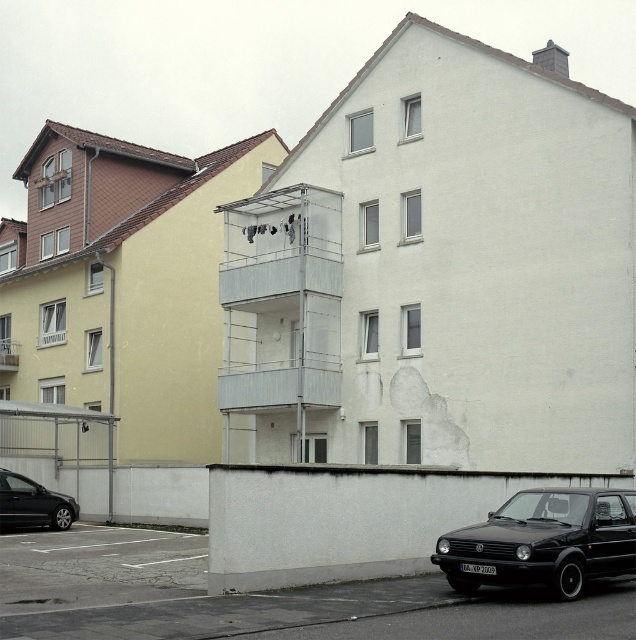
Question: Which point is closer to the camera?

Choices:
 (A) black matte car at lower left
 (B) black matte hatchback at lower right

Answer: (B)

Question: Can you confirm if black matte hatchback at lower right is wider than black matte car at lower left?

Choices:
 (A) yes
 (B) no

Answer: (A)

Question: From the image, what is the correct spatial relationship of black matte hatchback at lower right in relation to black matte car at lower left?

Choices:
 (A) below
 (B) above

Answer: (B)

Question: Which object is farther from the camera taking this photo?

Choices:
 (A) black matte hatchback at lower right
 (B) black matte car at lower left

Answer: (B)

Question: Does black matte hatchback at lower right have a lesser width compared to black matte car at lower left?

Choices:
 (A) yes
 (B) no

Answer: (B)